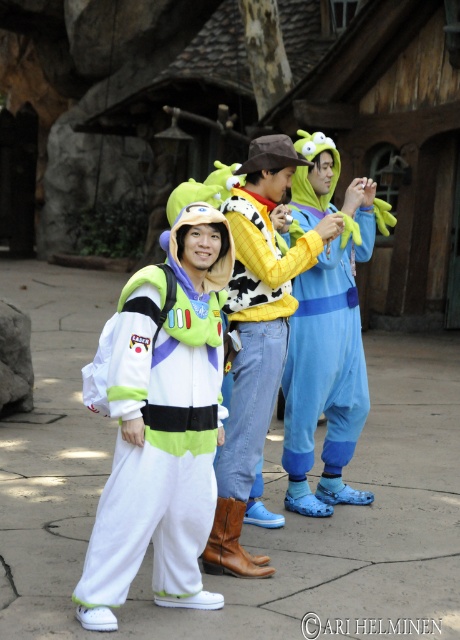
Question: Can you confirm if white fleece jacket at center is thinner than yellow plush toy at center?

Choices:
 (A) yes
 (B) no

Answer: (B)

Question: Does white fleece jacket at center have a larger size compared to blue plush onesie at center?

Choices:
 (A) no
 (B) yes

Answer: (A)

Question: Which object is closer to the camera taking this photo?

Choices:
 (A) yellow plush toy at center
 (B) white fleece jacket at center
 (C) blue plush onesie at center

Answer: (B)

Question: Among these objects, which one is farthest from the camera?

Choices:
 (A) white fleece jacket at center
 (B) yellow plush toy at center
 (C) blue plush onesie at center

Answer: (C)

Question: Is white fleece jacket at center bigger than blue plush onesie at center?

Choices:
 (A) no
 (B) yes

Answer: (A)

Question: Estimate the real-world distances between objects in this image. Which object is farther from the blue plush onesie at center?

Choices:
 (A) white fleece jacket at center
 (B) yellow plush toy at center

Answer: (A)